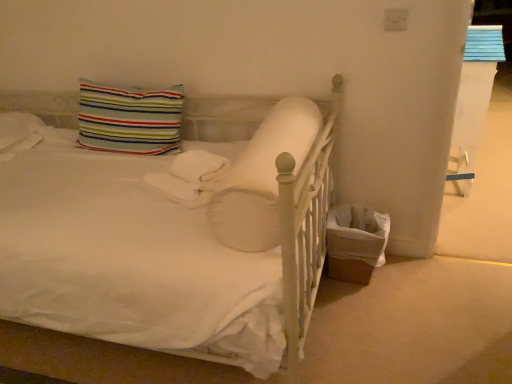
Describe the element at coordinates (261, 177) in the screenshot. I see `white soft pillow at center, the 1th pillow viewed from the right` at that location.

Image resolution: width=512 pixels, height=384 pixels. Find the location of `white soft pillow at center, placed as the 2th pillow when sorted from back to front`. white soft pillow at center, placed as the 2th pillow when sorted from back to front is located at coordinates (261, 177).

What do you see at coordinates (129, 118) in the screenshot?
I see `striped fabric pillow at upper left, marked as the 1th pillow in a back-to-front arrangement` at bounding box center [129, 118].

You are a GUI agent. You are given a task and a screenshot of the screen. Output one action in this format:
    pyautogui.click(x=<x>, y=<y>)
    Task: Click on the striped fabric pillow at upper left, marked as the 2th pillow in a front-to-back arrangement
    
    Given the screenshot: What is the action you would take?
    pyautogui.click(x=129, y=118)

How much space does striped fabric pillow at upper left, marked as the 1th pillow in a back-to-front arrangement, occupy horizontally?

It is 8.16 inches.

You are a GUI agent. You are given a task and a screenshot of the screen. Output one action in this format:
    pyautogui.click(x=<x>, y=<y>)
    Task: Click on the white soft pillow at center, the 1th pillow viewed from the right
    
    Given the screenshot: What is the action you would take?
    pyautogui.click(x=261, y=177)

Which is more to the right, white soft pillow at center, marked as the first pillow in a front-to-back arrangement, or striped fabric pillow at upper left, marked as the 2th pillow in a front-to-back arrangement?

white soft pillow at center, marked as the first pillow in a front-to-back arrangement, is more to the right.

Who is more distant, white soft pillow at center, the 1th pillow viewed from the right, or striped fabric pillow at upper left, marked as the 1th pillow in a back-to-front arrangement?

striped fabric pillow at upper left, marked as the 1th pillow in a back-to-front arrangement.

Which is in front, point (212, 180) or point (103, 116)?

The point (212, 180) is in front.

From the image's perspective, between white soft pillow at center, placed as the 2th pillow when sorted from back to front, and striped fabric pillow at upper left, marked as the 2th pillow in a front-to-back arrangement, who is located below?

white soft pillow at center, placed as the 2th pillow when sorted from back to front, from the image's perspective.

From a real-world perspective, does white soft pillow at center, marked as the first pillow in a front-to-back arrangement, stand above striped fabric pillow at upper left, which is the first pillow in left-to-right order?

Actually, white soft pillow at center, marked as the first pillow in a front-to-back arrangement, is physically below striped fabric pillow at upper left, which is the first pillow in left-to-right order, in the real world.

Looking at their sizes, would you say white soft pillow at center, which is the 2th pillow from left to right, is wider or thinner than striped fabric pillow at upper left, the second pillow in the right-to-left sequence?

white soft pillow at center, which is the 2th pillow from left to right, is wider than striped fabric pillow at upper left, the second pillow in the right-to-left sequence.

Is white soft pillow at center, the 1th pillow viewed from the right, taller than striped fabric pillow at upper left, which is the first pillow in left-to-right order?

In fact, white soft pillow at center, the 1th pillow viewed from the right, may be shorter than striped fabric pillow at upper left, which is the first pillow in left-to-right order.

Considering the relative sizes of white soft pillow at center, which is the 2th pillow from left to right, and striped fabric pillow at upper left, the second pillow in the right-to-left sequence, in the image provided, is white soft pillow at center, which is the 2th pillow from left to right, bigger than striped fabric pillow at upper left, the second pillow in the right-to-left sequence,?

Yes, white soft pillow at center, which is the 2th pillow from left to right, is bigger than striped fabric pillow at upper left, the second pillow in the right-to-left sequence.

Is white soft pillow at center, marked as the first pillow in a front-to-back arrangement, located outside striped fabric pillow at upper left, the second pillow in the right-to-left sequence?

white soft pillow at center, marked as the first pillow in a front-to-back arrangement, lies outside striped fabric pillow at upper left, the second pillow in the right-to-left sequence,'s area.

Is white soft pillow at center, marked as the first pillow in a front-to-back arrangement, not near striped fabric pillow at upper left, which is the first pillow in left-to-right order?

That's not correct — white soft pillow at center, marked as the first pillow in a front-to-back arrangement, is a little close to striped fabric pillow at upper left, which is the first pillow in left-to-right order.

Is white soft pillow at center, placed as the 2th pillow when sorted from back to front, positioned with its back to striped fabric pillow at upper left, marked as the 2th pillow in a front-to-back arrangement?

No, white soft pillow at center, placed as the 2th pillow when sorted from back to front,'s orientation is not away from striped fabric pillow at upper left, marked as the 2th pillow in a front-to-back arrangement.

The image size is (512, 384). I want to click on pillow located underneath the striped fabric pillow at upper left, marked as the 1th pillow in a back-to-front arrangement (from a real-world perspective), so click(261, 177).

Considering the positions of objects striped fabric pillow at upper left, which is the first pillow in left-to-right order, and white soft pillow at center, placed as the 2th pillow when sorted from back to front, in the image provided, who is more to the right, striped fabric pillow at upper left, which is the first pillow in left-to-right order, or white soft pillow at center, placed as the 2th pillow when sorted from back to front,?

white soft pillow at center, placed as the 2th pillow when sorted from back to front.

Which object is closer to the camera, striped fabric pillow at upper left, which is the first pillow in left-to-right order, or white soft pillow at center, marked as the first pillow in a front-to-back arrangement?

Positioned in front is white soft pillow at center, marked as the first pillow in a front-to-back arrangement.

Does point (170, 125) come in front of point (292, 114)?

No, it is behind (292, 114).

From the image's perspective, which object appears higher, striped fabric pillow at upper left, the second pillow in the right-to-left sequence, or white soft pillow at center, marked as the first pillow in a front-to-back arrangement?

striped fabric pillow at upper left, the second pillow in the right-to-left sequence.

From a real-world perspective, is striped fabric pillow at upper left, the second pillow in the right-to-left sequence, physically above white soft pillow at center, placed as the 2th pillow when sorted from back to front?

Yes, from a real-world perspective, striped fabric pillow at upper left, the second pillow in the right-to-left sequence, is above white soft pillow at center, placed as the 2th pillow when sorted from back to front.

Does striped fabric pillow at upper left, marked as the 2th pillow in a front-to-back arrangement, have a greater width compared to white soft pillow at center, placed as the 2th pillow when sorted from back to front?

Incorrect, the width of striped fabric pillow at upper left, marked as the 2th pillow in a front-to-back arrangement, does not surpass that of white soft pillow at center, placed as the 2th pillow when sorted from back to front.

From their relative heights in the image, would you say striped fabric pillow at upper left, marked as the 2th pillow in a front-to-back arrangement, is taller or shorter than white soft pillow at center, marked as the first pillow in a front-to-back arrangement?

In the image, striped fabric pillow at upper left, marked as the 2th pillow in a front-to-back arrangement, appears to be taller than white soft pillow at center, marked as the first pillow in a front-to-back arrangement.

Who is bigger, striped fabric pillow at upper left, which is the first pillow in left-to-right order, or white soft pillow at center, the 1th pillow viewed from the right?

white soft pillow at center, the 1th pillow viewed from the right.

Would you say striped fabric pillow at upper left, marked as the 1th pillow in a back-to-front arrangement, is outside white soft pillow at center, which is the 2th pillow from left to right?

striped fabric pillow at upper left, marked as the 1th pillow in a back-to-front arrangement, lies outside white soft pillow at center, which is the 2th pillow from left to right,'s area.

Is striped fabric pillow at upper left, which is the first pillow in left-to-right order, not close to white soft pillow at center, marked as the first pillow in a front-to-back arrangement?

No.

Is striped fabric pillow at upper left, marked as the 1th pillow in a back-to-front arrangement, positioned with its back to white soft pillow at center, placed as the 2th pillow when sorted from back to front?

No, white soft pillow at center, placed as the 2th pillow when sorted from back to front, is not at the back of striped fabric pillow at upper left, marked as the 1th pillow in a back-to-front arrangement.

How different are the orientations of striped fabric pillow at upper left, marked as the 1th pillow in a back-to-front arrangement, and white soft pillow at center, marked as the first pillow in a front-to-back arrangement, in degrees?

2.56 degrees separate the facing orientations of striped fabric pillow at upper left, marked as the 1th pillow in a back-to-front arrangement, and white soft pillow at center, marked as the first pillow in a front-to-back arrangement.

Based on the photo, how far apart are striped fabric pillow at upper left, which is the first pillow in left-to-right order, and white soft pillow at center, the 1th pillow viewed from the right?

striped fabric pillow at upper left, which is the first pillow in left-to-right order, is 30.27 inches from white soft pillow at center, the 1th pillow viewed from the right.

In order to click on pillow behind the white soft pillow at center, marked as the first pillow in a front-to-back arrangement in this screenshot , I will do `click(129, 118)`.

Locate an element on the screen. pillow that appears below the striped fabric pillow at upper left, the second pillow in the right-to-left sequence (from a real-world perspective) is located at coordinates 261,177.

At what (x,y) coordinates should I click in order to perform the action: click on pillow in front of the striped fabric pillow at upper left, which is the first pillow in left-to-right order. Please return your answer as a coordinate pair (x, y). Looking at the image, I should click on (261, 177).